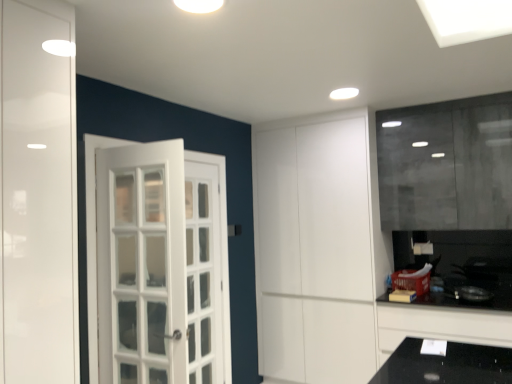
The height and width of the screenshot is (384, 512). Find the location of `black glossy countertop at lower right`. black glossy countertop at lower right is located at coordinates pyautogui.click(x=440, y=325).

This screenshot has height=384, width=512. What do you see at coordinates (440, 325) in the screenshot? I see `black glossy countertop at lower right` at bounding box center [440, 325].

Describe the element at coordinates (315, 250) in the screenshot. The image size is (512, 384). I see `white matte cabinet at center` at that location.

You are a GUI agent. You are given a task and a screenshot of the screen. Output one action in this format:
    pyautogui.click(x=<x>, y=<y>)
    Task: Click on the white matte cabinet at center
    The height and width of the screenshot is (384, 512).
    Given the screenshot: What is the action you would take?
    pyautogui.click(x=315, y=250)

At what (x,y) coordinates should I click in order to perform the action: click on black glossy countertop at lower right. Please return your answer as a coordinate pair (x, y). The width and height of the screenshot is (512, 384). Looking at the image, I should click on (440, 325).

Does black glossy countertop at lower right appear on the right side of white matte cabinet at center?

Yes.

Which is behind, black glossy countertop at lower right or white matte cabinet at center?

white matte cabinet at center.

Considering the positions of point (485, 323) and point (371, 326), is point (485, 323) closer or farther from the camera than point (371, 326)?

Point (485, 323) appears to be closer to the viewer than point (371, 326).

From the image's perspective, would you say black glossy countertop at lower right is shown under white matte cabinet at center?

Yes, from the image's perspective, black glossy countertop at lower right is beneath white matte cabinet at center.

From a real-world perspective, is black glossy countertop at lower right positioned above or below white matte cabinet at center?

In terms of real-world spatial position, black glossy countertop at lower right is below white matte cabinet at center.

Which object is wider, black glossy countertop at lower right or white matte cabinet at center?

Wider between the two is white matte cabinet at center.

Does black glossy countertop at lower right have a lesser height compared to white matte cabinet at center?

Yes, black glossy countertop at lower right is shorter than white matte cabinet at center.

Between black glossy countertop at lower right and white matte cabinet at center, which one has larger size?

Bigger between the two is white matte cabinet at center.

Choose the correct answer: Is black glossy countertop at lower right inside white matte cabinet at center or outside it?

black glossy countertop at lower right is located beyond the bounds of white matte cabinet at center.

From the picture: Is black glossy countertop at lower right not close to white matte cabinet at center?

Actually, black glossy countertop at lower right and white matte cabinet at center are a little close together.

In the scene shown: Is black glossy countertop at lower right positioned with its back to white matte cabinet at center?

No, black glossy countertop at lower right's orientation is not away from white matte cabinet at center.

At what (x,y) coordinates should I click in order to perform the action: click on door above the black glossy countertop at lower right (from the image's perspective). Please return your answer as a coordinate pair (x, y). Image resolution: width=512 pixels, height=384 pixels. Looking at the image, I should click on (315, 250).

Based on the photo, considering the positions of objects white matte cabinet at center and black glossy countertop at lower right in the image provided, who is more to the left, white matte cabinet at center or black glossy countertop at lower right?

Positioned to the left is white matte cabinet at center.

Is white matte cabinet at center further to camera compared to black glossy countertop at lower right?

Yes, it is.

Is point (367, 165) positioned behind point (481, 343)?

Yes, point (367, 165) is behind point (481, 343).

From the image's perspective, relative to black glossy countertop at lower right, is white matte cabinet at center above or below?

white matte cabinet at center is situated higher than black glossy countertop at lower right in the image.

From a real-world perspective, is white matte cabinet at center located higher than black glossy countertop at lower right?

Yes.

Does white matte cabinet at center have a greater width compared to black glossy countertop at lower right?

Yes.

Considering the relative sizes of white matte cabinet at center and black glossy countertop at lower right in the image provided, is white matte cabinet at center taller than black glossy countertop at lower right?

Yes, white matte cabinet at center is taller than black glossy countertop at lower right.

In terms of size, does white matte cabinet at center appear bigger or smaller than black glossy countertop at lower right?

Considering their sizes, white matte cabinet at center takes up more space than black glossy countertop at lower right.

Would you say white matte cabinet at center is outside black glossy countertop at lower right?

Indeed, white matte cabinet at center is completely outside black glossy countertop at lower right.

Is white matte cabinet at center not close to black glossy countertop at lower right?

Actually, white matte cabinet at center and black glossy countertop at lower right are a little close together.

Is white matte cabinet at center positioned with its back to black glossy countertop at lower right?

No, black glossy countertop at lower right is not at the back of white matte cabinet at center.

Find the location of `door above the black glossy countertop at lower right (from the image's perspective)`. door above the black glossy countertop at lower right (from the image's perspective) is located at coordinates (315, 250).

The height and width of the screenshot is (384, 512). What are the coordinates of `cabinetry located on the right of white matte cabinet at center` in the screenshot? It's located at (440, 325).

Find the location of a particular element. cabinetry that appears below the white matte cabinet at center (from the image's perspective) is located at coordinates (440, 325).